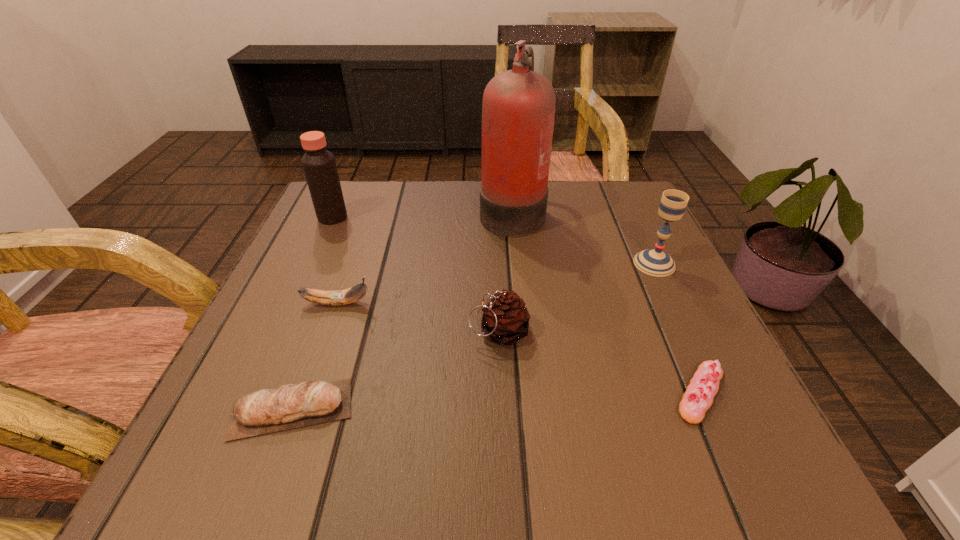
Select which object appears as the fifth closest to the tallest object. Please provide its 2D coordinates. Your answer should be formatted as a tuple, i.e. [(x, y)], where the tuple contains the x and y coordinates of a point satisfying the conditions above.

[(698, 398)]

Image resolution: width=960 pixels, height=540 pixels. I want to click on the fourth closest object relative to the vinegar, so point(290,406).

The height and width of the screenshot is (540, 960). What are the coordinates of `vacant area in the image that satisfies the following two spatial constraints: 1. on the back side of the second shortest object; 2. on the left side of the eclair` in the screenshot? It's located at (298, 393).

This screenshot has height=540, width=960. Identify the location of free spot that satisfies the following two spatial constraints: 1. with a leaf charm attached to the fourth shortest object; 2. on the left side of the shortest object. (501, 393).

Identify the location of free point that satisfies the following two spatial constraints: 1. on the front side of the fifth nearest object; 2. on the right side of the vinegar. This screenshot has height=540, width=960. 312,264.

I want to click on vacant space that satisfies the following two spatial constraints: 1. with a leaf charm attached to the shortest object; 2. on the right side of the fifth farthest object, so click(501, 393).

Where is `free spot that satisfies the following two spatial constraints: 1. with a leaf charm attached to the fifth farthest object; 2. on the right side of the shortest object`? This screenshot has height=540, width=960. free spot that satisfies the following two spatial constraints: 1. with a leaf charm attached to the fifth farthest object; 2. on the right side of the shortest object is located at coordinates (501, 393).